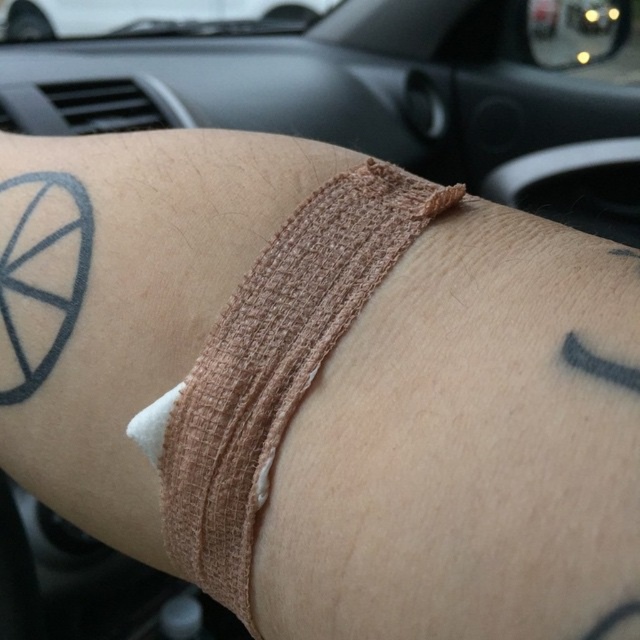
Question: Is the position of beige fabric bandage at center more distant than that of white matte car at upper center?

Choices:
 (A) yes
 (B) no

Answer: (B)

Question: From the image, what is the correct spatial relationship of beige fabric bandage at center in relation to white matte car at upper center?

Choices:
 (A) left
 (B) right

Answer: (B)

Question: Is beige fabric bandage at center to the right of white matte car at upper center from the viewer's perspective?

Choices:
 (A) yes
 (B) no

Answer: (A)

Question: Which point appears closest to the camera in this image?

Choices:
 (A) (227, 429)
 (B) (177, 3)

Answer: (A)